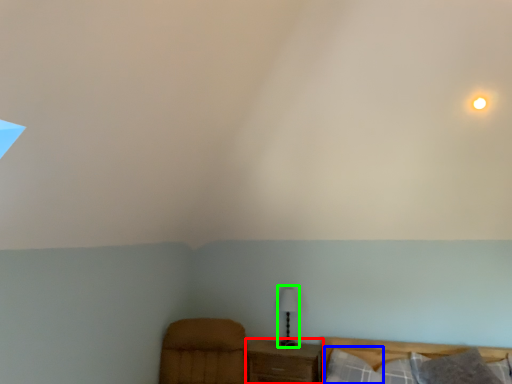
Question: Estimate the real-world distances between objects in this image. Which object is farther from nightstand (highlighted by a red box), pillow (highlighted by a blue box) or table lamp (highlighted by a green box)?

Choices:
 (A) pillow
 (B) table lamp

Answer: (B)